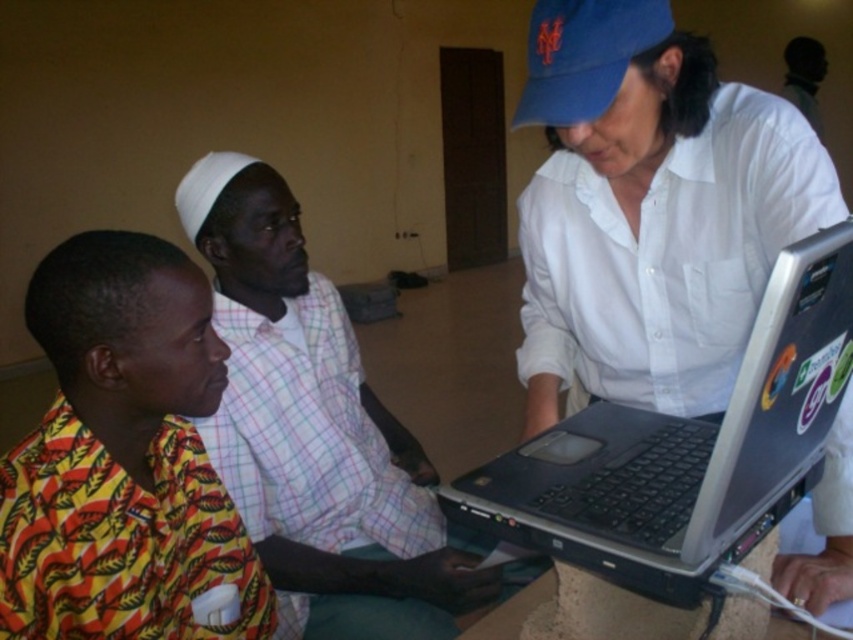
Question: Does plaid fabric shirt at center have a larger size compared to dark skin man at upper right?

Choices:
 (A) yes
 (B) no

Answer: (A)

Question: Does blue fabric baseball cap at upper center come in front of dark skin man at upper right?

Choices:
 (A) yes
 (B) no

Answer: (A)

Question: Estimate the real-world distances between objects in this image. Which object is farther from the blue fabric baseball cap at upper center?

Choices:
 (A) dark skin man at upper right
 (B) plaid fabric shirt at center

Answer: (A)

Question: Among these objects, which one is farthest from the camera?

Choices:
 (A) silver metallic laptop at center
 (B) dark skin man at upper right
 (C) plaid fabric shirt at center

Answer: (B)

Question: Estimate the real-world distances between objects in this image. Which object is farther from the dark skin man at upper right?

Choices:
 (A) silver metallic laptop at center
 (B) blue fabric baseball cap at upper center
 (C) plaid fabric shirt at center

Answer: (B)

Question: Is plaid fabric shirt at center above blue fabric baseball cap at upper center?

Choices:
 (A) yes
 (B) no

Answer: (B)